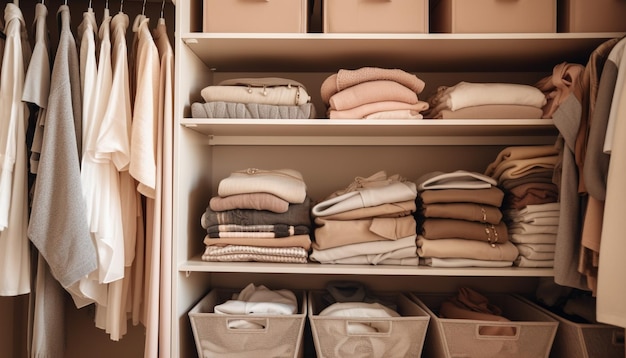
Find the location of a particular element. This screenshot has width=626, height=358. baskets on bottom shelf is located at coordinates (245, 341), (336, 332), (471, 345), (595, 342).